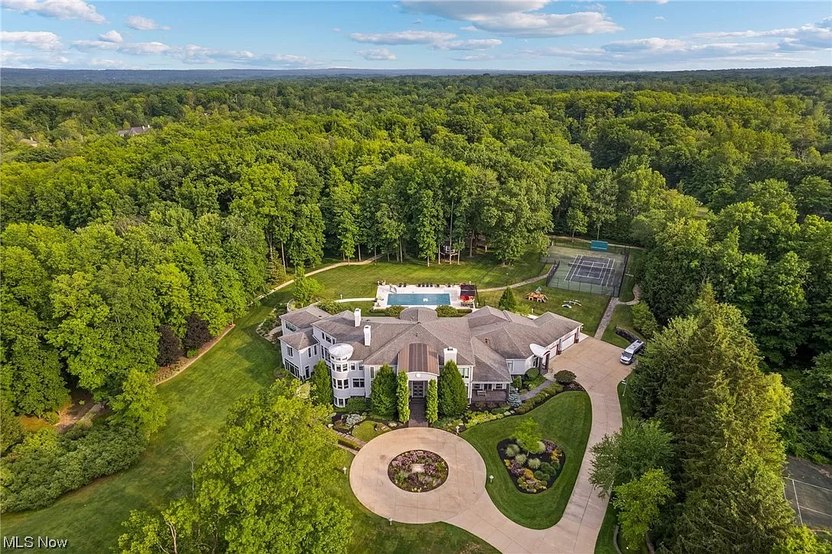
Where is `the front door`? The width and height of the screenshot is (832, 554). the front door is located at coordinates (418, 396).